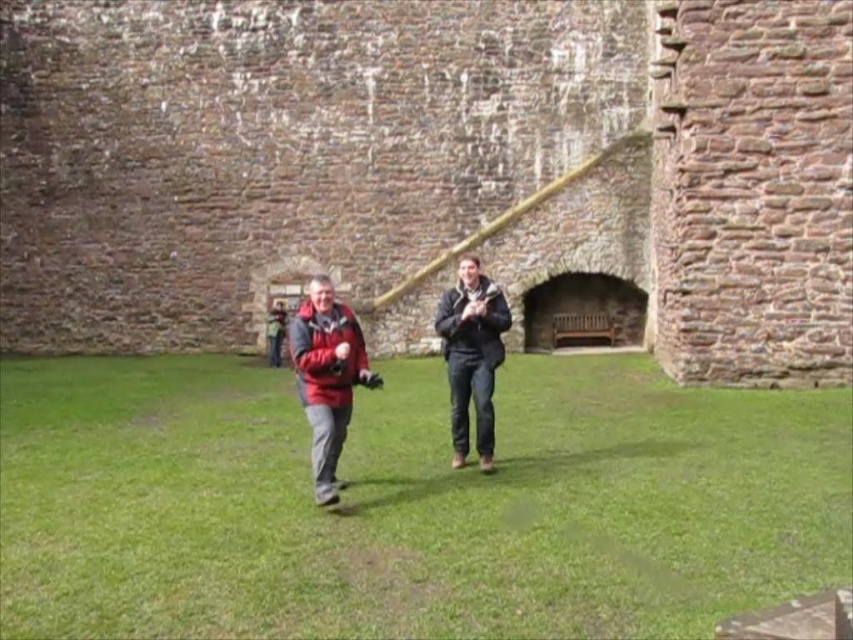
You are a tour guide leading visitors through the historic stone structure. You notice two jackets left behind by visitors at the center of the path. The jackets are the matte black jacket at center and the dark brown leather jacket at center. Which jacket is closer to the visitors currently walking towards the entrance on the right?

The matte black jacket at center is in front of the dark brown leather jacket at center, so it is closer to the visitors walking towards the entrance on the right.

You are a painter who needs to set up an easel. You see a brick wall at center and a dark brown leather jacket at center. Which object would provide a more stable surface for placing your easel?

The brick wall at center has a larger size compared to the dark brown leather jacket at center, so the brick wall at center would provide a more stable surface for placing the easel.

You are a gardener who needs to mow the green grass at center. However, there is a matte red jacket at center in the way. Can you mow the grass without moving the jacket?

The green grass at center has a lesser height compared to matte red jacket at center, so the mower can pass under the matte red jacket at center without damaging it. Therefore, you can mow the grass without moving the jacket.